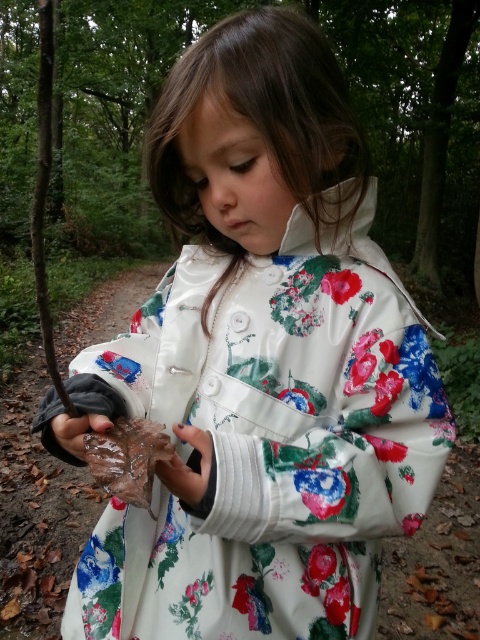
Question: Does brown rough twig at left appear over transparent plastic leaf at lower left?

Choices:
 (A) yes
 (B) no

Answer: (A)

Question: From the image, what is the correct spatial relationship of matte brown glove at center in relation to transparent plastic leaf at lower left?

Choices:
 (A) left
 (B) right

Answer: (B)

Question: Which point is closer to the camera?

Choices:
 (A) brown rough twig at left
 (B) transparent plastic leaf at lower left

Answer: (A)

Question: Which point appears farthest from the camera in this image?

Choices:
 (A) (204, 492)
 (B) (43, 108)
 (C) (67, 413)

Answer: (C)

Question: Among these points, which one is nearest to the camera?

Choices:
 (A) (94, 429)
 (B) (47, 13)
 (C) (180, 492)

Answer: (B)

Question: Can you confirm if brown rough twig at left is wider than transparent plastic leaf at lower left?

Choices:
 (A) no
 (B) yes

Answer: (B)